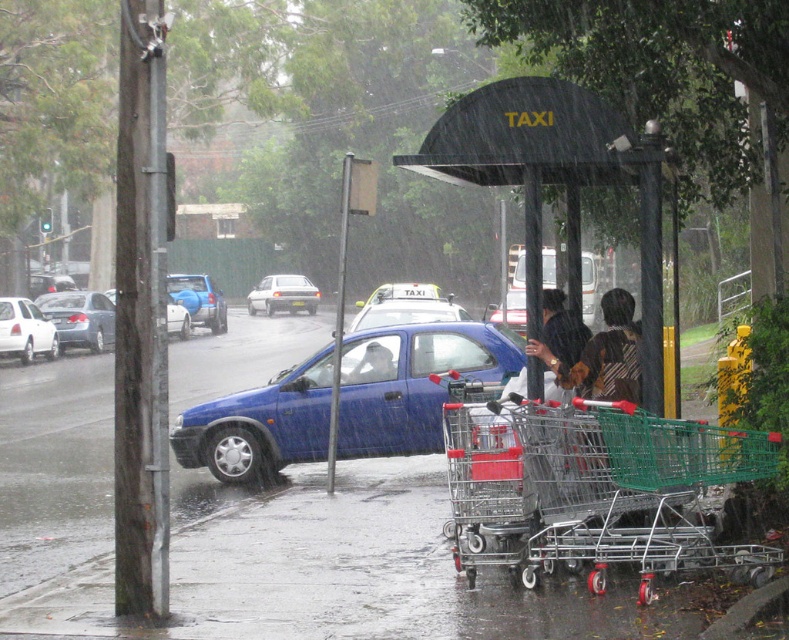
Question: Which object appears closest to the camera in this image?

Choices:
 (A) brown textured jacket at center
 (B) blue matte hatchback at center-left
 (C) white glossy sedan at left

Answer: (B)

Question: Where is metallic blue car at center located in relation to matte black sedan at left in the image?

Choices:
 (A) above
 (B) below

Answer: (B)

Question: Which of the following is the farthest from the observer?

Choices:
 (A) blue matte hatchback at center-left
 (B) matte black sedan at left
 (C) black plastic taxi stand at center
 (D) brown textured jacket at center

Answer: (B)

Question: Which object appears closest to the camera in this image?

Choices:
 (A) metallic blue car at center
 (B) matte black sedan at left

Answer: (A)

Question: Is the position of brown textured jacket at center less distant than that of matte black sedan at left?

Choices:
 (A) yes
 (B) no

Answer: (A)

Question: Is brown textured jacket at center closer to the viewer compared to blue matte hatchback at center-left?

Choices:
 (A) no
 (B) yes

Answer: (A)